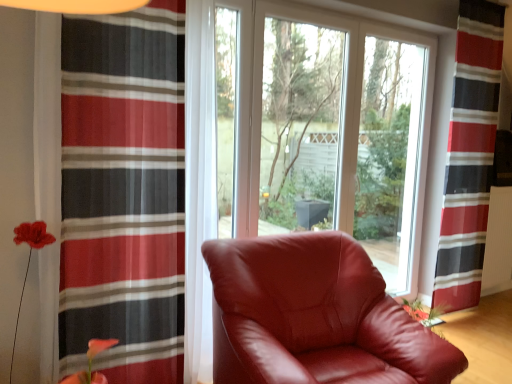
Question: Considering the relative sizes of white textured radiator at right and striped sheer curtain at left, which ranks as the first curtain in front-to-back order, in the image provided, is white textured radiator at right bigger than striped sheer curtain at left, which ranks as the first curtain in front-to-back order,?

Choices:
 (A) no
 (B) yes

Answer: (A)

Question: From the image's perspective, does white textured radiator at right appear higher than striped sheer curtain at left, acting as the second curtain starting from the right?

Choices:
 (A) no
 (B) yes

Answer: (A)

Question: Could you tell me if white textured radiator at right is turned towards striped sheer curtain at left, the 2th curtain in the back-to-front sequence?

Choices:
 (A) no
 (B) yes

Answer: (A)

Question: Is white textured radiator at right turned away from striped sheer curtain at left, which ranks as the first curtain in front-to-back order?

Choices:
 (A) yes
 (B) no

Answer: (B)

Question: Is white textured radiator at right outside striped sheer curtain at left, the 2th curtain in the back-to-front sequence?

Choices:
 (A) yes
 (B) no

Answer: (A)

Question: Are white textured radiator at right and striped sheer curtain at left, placed as the 1th curtain when sorted from left to right, far apart?

Choices:
 (A) yes
 (B) no

Answer: (A)

Question: Can you confirm if transparent glass window at center is smaller than satin burgundy armchair at center?

Choices:
 (A) no
 (B) yes

Answer: (B)

Question: Is transparent glass window at center facing towards satin burgundy armchair at center?

Choices:
 (A) yes
 (B) no

Answer: (A)

Question: Is transparent glass window at center to the right of satin burgundy armchair at center from the viewer's perspective?

Choices:
 (A) no
 (B) yes

Answer: (B)

Question: Is the depth of transparent glass window at center less than that of satin burgundy armchair at center?

Choices:
 (A) yes
 (B) no

Answer: (B)

Question: Does transparent glass window at center have a lesser height compared to satin burgundy armchair at center?

Choices:
 (A) yes
 (B) no

Answer: (B)

Question: From the image's perspective, is transparent glass window at center below satin burgundy armchair at center?

Choices:
 (A) no
 (B) yes

Answer: (A)

Question: Does satin burgundy armchair at center have a lesser width compared to transparent glass window at center?

Choices:
 (A) no
 (B) yes

Answer: (A)